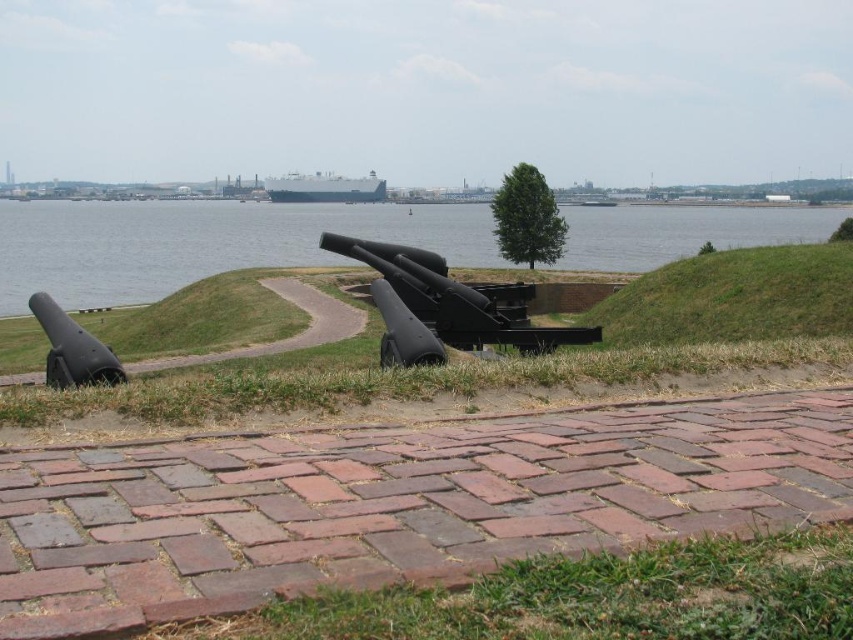
Which of these two, blue water at center or matte black cannon at left, stands taller?

blue water at center is taller.

The width and height of the screenshot is (853, 640). Find the location of `blue water at center`. blue water at center is located at coordinates (202, 243).

Based on the photo, does blue water at center have a smaller size compared to black matte cannon at center?

No.

Consider the image. Who is lower down, blue water at center or black matte cannon at center?

black matte cannon at center is below.

Is point (329, 257) positioned behind point (552, 328)?

Yes, it is.

What are the coordinates of `blue water at center` in the screenshot? It's located at (202, 243).

Is black matte cannon at center below matte black cannon at left?

Actually, black matte cannon at center is above matte black cannon at left.

You are a GUI agent. You are given a task and a screenshot of the screen. Output one action in this format:
    pyautogui.click(x=<x>, y=<y>)
    Task: Click on the black matte cannon at center
    
    Given the screenshot: What is the action you would take?
    pyautogui.click(x=445, y=307)